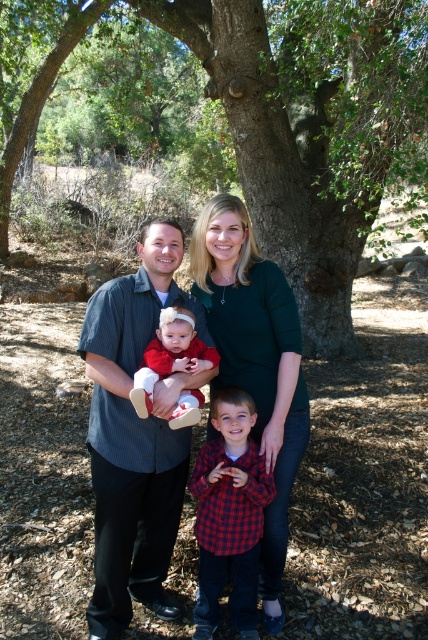
Question: Which point appears farthest from the camera in this image?

Choices:
 (A) (183, 326)
 (B) (103, 573)

Answer: (B)

Question: Which object is positioned farthest from the red plaid shirt at center?

Choices:
 (A) dark gray shirt at center
 (B) matte red dress at center

Answer: (B)

Question: Which of the following is the closest to the observer?

Choices:
 (A) (238, 246)
 (B) (217, 525)
 (C) (186, 349)

Answer: (C)

Question: Does green matte shirt at center come in front of matte red dress at center?

Choices:
 (A) yes
 (B) no

Answer: (B)

Question: Is green leafy tree at center to the left of dark gray shirt at center from the viewer's perspective?

Choices:
 (A) yes
 (B) no

Answer: (A)

Question: Observing the image, what is the correct spatial positioning of red plaid shirt at center in reference to matte red dress at center?

Choices:
 (A) below
 (B) above

Answer: (A)